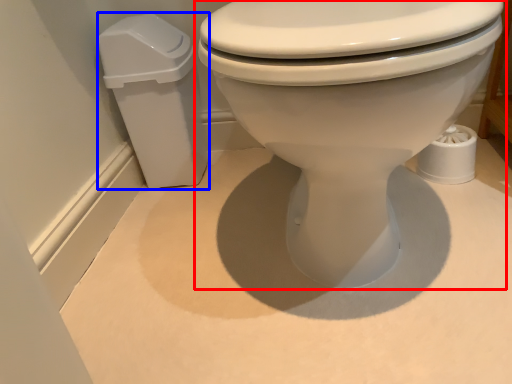
Question: Which of the following is the farthest to the observer, toilet (highlighted by a red box) or porcelain (highlighted by a blue box)?

Choices:
 (A) toilet
 (B) porcelain

Answer: (B)